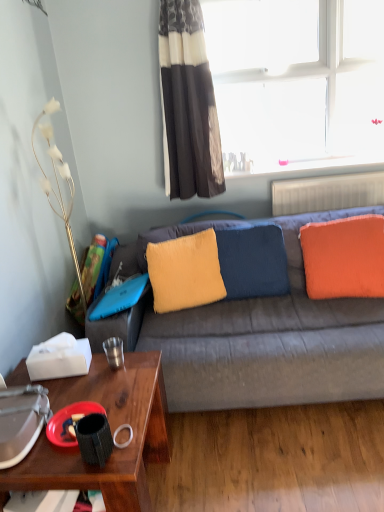
This screenshot has width=384, height=512. Identify the location of vacant region to the left of black textured coffee cup at lower left, the first coffee cup in the front-to-back sequence. (49, 462).